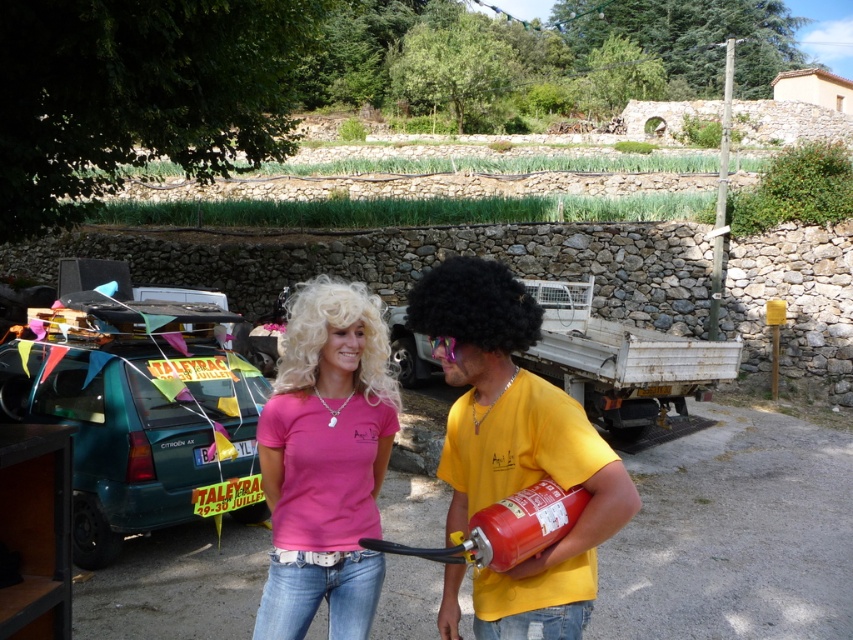
Can you confirm if pink matte t-shirt at center is positioned to the right of red matte extinguisher at center?

Incorrect, pink matte t-shirt at center is not on the right side of red matte extinguisher at center.

Is pink matte t-shirt at center wider than red matte extinguisher at center?

Yes.

Is point (326, 324) farther from viewer compared to point (503, 497)?

Yes.

Locate an element on the screen. Image resolution: width=853 pixels, height=640 pixels. pink matte t-shirt at center is located at coordinates (326, 461).

Which of these two, pink matte t-shirt at center or blonde curly hair at center, stands taller?

Standing taller between the two is blonde curly hair at center.

Does pink matte t-shirt at center lie behind blonde curly hair at center?

No, pink matte t-shirt at center is in front of blonde curly hair at center.

This screenshot has width=853, height=640. In order to click on pink matte t-shirt at center in this screenshot , I will do `click(326, 461)`.

Does point (355, 436) lie behind point (498, 344)?

Yes, point (355, 436) is behind point (498, 344).

This screenshot has width=853, height=640. In order to click on pink matte t-shirt at center in this screenshot , I will do `click(326, 461)`.